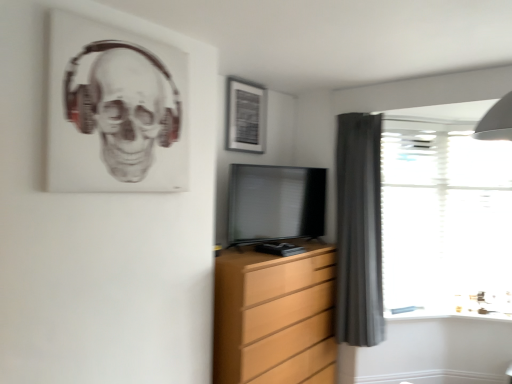
Question: Does matte black tv at center appear on the left side of dark gray fabric curtain at right?

Choices:
 (A) no
 (B) yes

Answer: (B)

Question: Is there a large distance between matte black tv at center and dark gray fabric curtain at right?

Choices:
 (A) no
 (B) yes

Answer: (A)

Question: Does matte black tv at center turn towards dark gray fabric curtain at right?

Choices:
 (A) yes
 (B) no

Answer: (B)

Question: Is matte black tv at center oriented away from dark gray fabric curtain at right?

Choices:
 (A) no
 (B) yes

Answer: (A)

Question: Can you confirm if matte black tv at center is thinner than dark gray fabric curtain at right?

Choices:
 (A) no
 (B) yes

Answer: (B)

Question: From the image's perspective, is matte black picture frame at upper center positioned above or below transparent glass door at right?

Choices:
 (A) above
 (B) below

Answer: (A)

Question: From a real-world perspective, is matte black picture frame at upper center above or below transparent glass door at right?

Choices:
 (A) below
 (B) above

Answer: (B)

Question: Considering the positions of matte black picture frame at upper center and transparent glass door at right in the image, is matte black picture frame at upper center wider or thinner than transparent glass door at right?

Choices:
 (A) wide
 (B) thin

Answer: (B)

Question: Is matte black picture frame at upper center inside or outside of transparent glass door at right?

Choices:
 (A) outside
 (B) inside

Answer: (A)

Question: From a real-world perspective, is transparent plastic window at right physically located above or below transparent glass door at right?

Choices:
 (A) above
 (B) below

Answer: (B)

Question: From the image's perspective, is transparent plastic window at right positioned above or below transparent glass door at right?

Choices:
 (A) below
 (B) above

Answer: (A)

Question: Considering the positions of point coord(401,200) and point coord(437,221), is point coord(401,200) closer or farther from the camera than point coord(437,221)?

Choices:
 (A) closer
 (B) farther

Answer: (A)

Question: Looking at their shapes, would you say transparent plastic window at right is wider or thinner than transparent glass door at right?

Choices:
 (A) thin
 (B) wide

Answer: (A)

Question: From the image's perspective, is dark gray fabric curtain at right located above or below matte black tv at center?

Choices:
 (A) above
 (B) below

Answer: (B)

Question: From a real-world perspective, relative to matte black tv at center, is dark gray fabric curtain at right vertically above or below?

Choices:
 (A) below
 (B) above

Answer: (A)